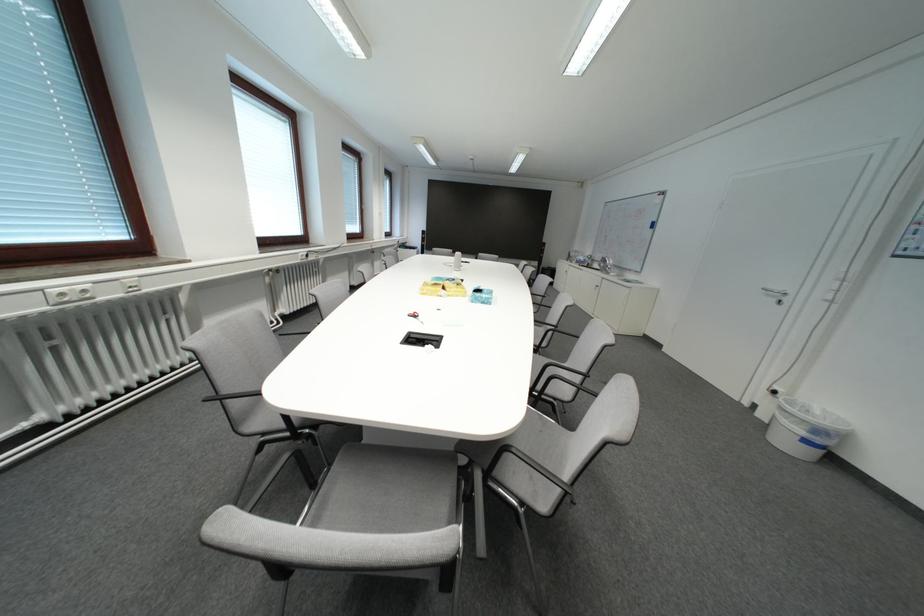
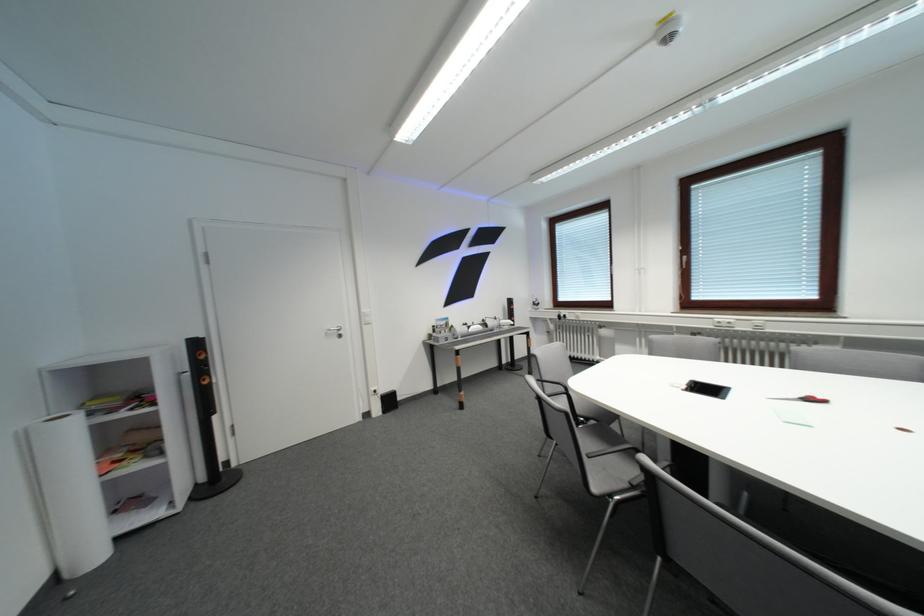
Find the pixel in the second image that matches point 440,349 in the first image.

(695, 389)